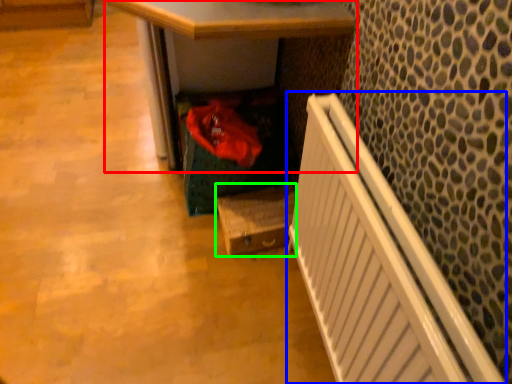
Question: Based on their relative distances, which object is farther from desk (highlighted by a red box)? Choose from radiator (highlighted by a blue box) and box (highlighted by a green box).

Choices:
 (A) radiator
 (B) box

Answer: (A)